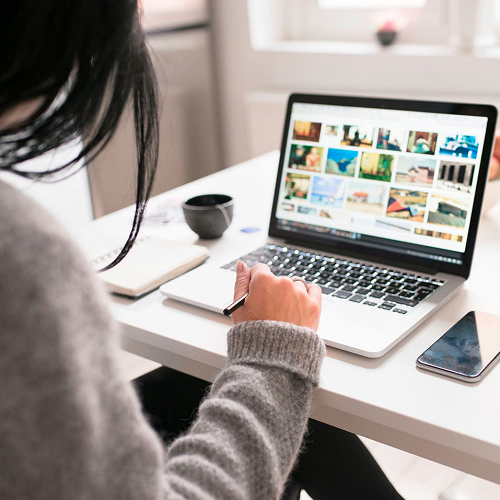
I want to click on cup, so click(227, 209).